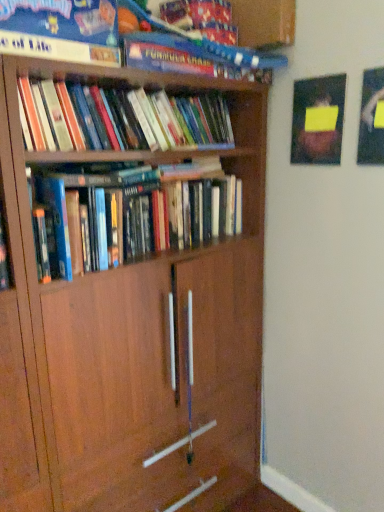
Question: From their relative heights in the image, would you say hardcover books at center, which is the third book in top-to-bottom order, is taller or shorter than hardcover book at upper center, the third book in the bottom-to-top sequence?

Choices:
 (A) tall
 (B) short

Answer: (A)

Question: Choose the correct answer: Is hardcover books at center, which is the third book in top-to-bottom order, inside hardcover book at upper center, which is the 1th book in top-to-bottom order, or outside it?

Choices:
 (A) outside
 (B) inside

Answer: (A)

Question: Which is nearer to the hardcover books at center, which is the third book in top-to-bottom order?

Choices:
 (A) hardcover books at upper left, the second book in the bottom-to-top sequence
 (B) hardcover book at upper center, which is the 1th book in top-to-bottom order

Answer: (A)

Question: Estimate the real-world distances between objects in this image. Which object is farther from the hardcover books at upper left, the second book in the bottom-to-top sequence?

Choices:
 (A) hardcover books at center, which is the third book in top-to-bottom order
 (B) hardcover book at upper center, the third book in the bottom-to-top sequence

Answer: (A)